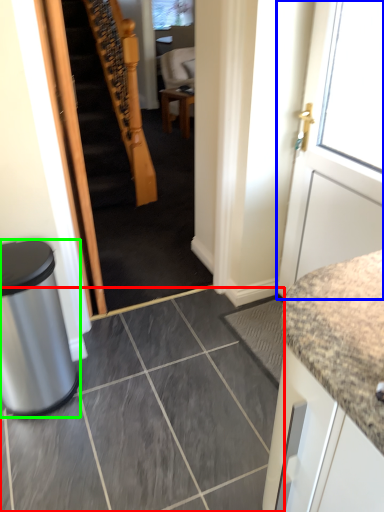
Question: Estimate the real-world distances between objects in this image. Which object is farther from ceramic tile (highlighted by a red box), door (highlighted by a blue box) or trash bin/can (highlighted by a green box)?

Choices:
 (A) door
 (B) trash bin/can

Answer: (A)